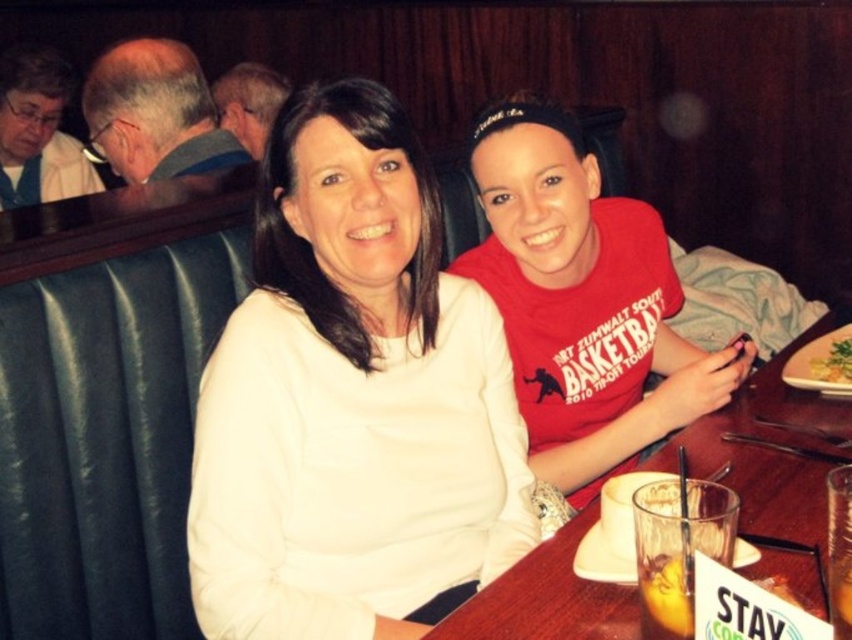
Question: Can you confirm if wooden table at center is smaller than translucent glass at table right?

Choices:
 (A) no
 (B) yes

Answer: (A)

Question: Which object is farther from the camera taking this photo?

Choices:
 (A) yellowish matte plate at lower right
 (B) white matte sweater at center
 (C) white ceramic plate at upper right

Answer: (A)

Question: Can you confirm if wooden table at center is positioned to the right of translucent glass at table right?

Choices:
 (A) no
 (B) yes

Answer: (B)

Question: Is white matte sweater at center in front of white ceramic plate at upper right?

Choices:
 (A) no
 (B) yes

Answer: (B)

Question: Which point is farther to the camera?

Choices:
 (A) (304, 227)
 (B) (536, 636)

Answer: (A)

Question: Which object appears farthest from the camera in this image?

Choices:
 (A) yellowish matte plate at lower right
 (B) white ceramic plate at upper right
 (C) wooden table at center
 (D) white matte sweater at center

Answer: (A)